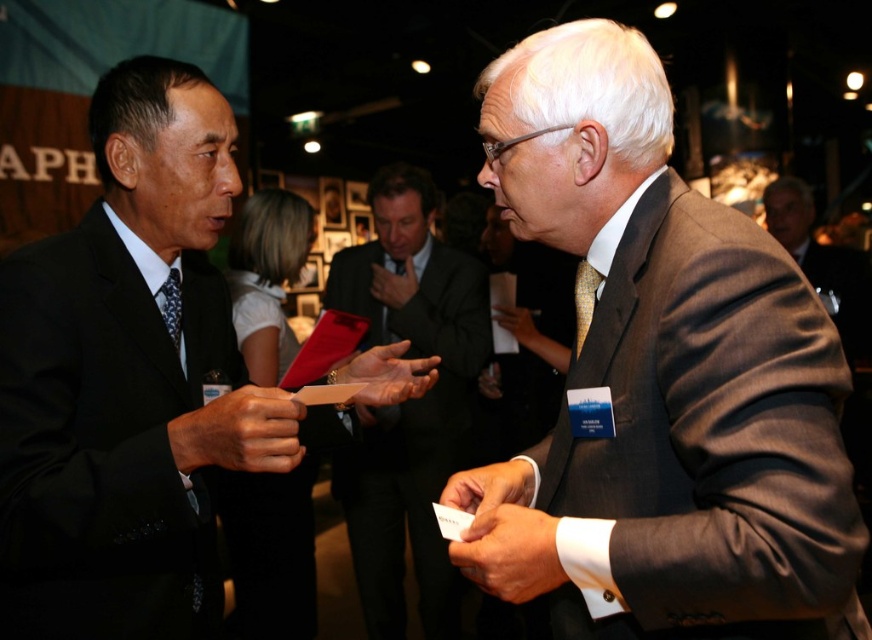
Is matte black suit at left smaller than matte black tie at left?

No.

Between point (25, 340) and point (161, 301), which one is positioned in front?

Positioned in front is point (25, 340).

Where is `matte black suit at left`? This screenshot has height=640, width=872. matte black suit at left is located at coordinates (106, 440).

Can you confirm if matte gray suit at center is wider than black satin suit at left?

No, matte gray suit at center is not wider than black satin suit at left.

Is matte gray suit at center thinner than black satin suit at left?

Yes.

Is point (659, 122) farther from camera compared to point (140, 497)?

Yes.

Locate an element on the screen. This screenshot has height=640, width=872. matte gray suit at center is located at coordinates (661, 380).

Is black satin suit at left taller than matte black tie at left?

Yes, black satin suit at left is taller than matte black tie at left.

Who is lower down, black satin suit at left or matte black tie at left?

Positioned lower is black satin suit at left.

Which is in front, point (164, 440) or point (174, 321)?

Point (164, 440) is in front.

Identify the location of black satin suit at left. The image size is (872, 640). (133, 381).